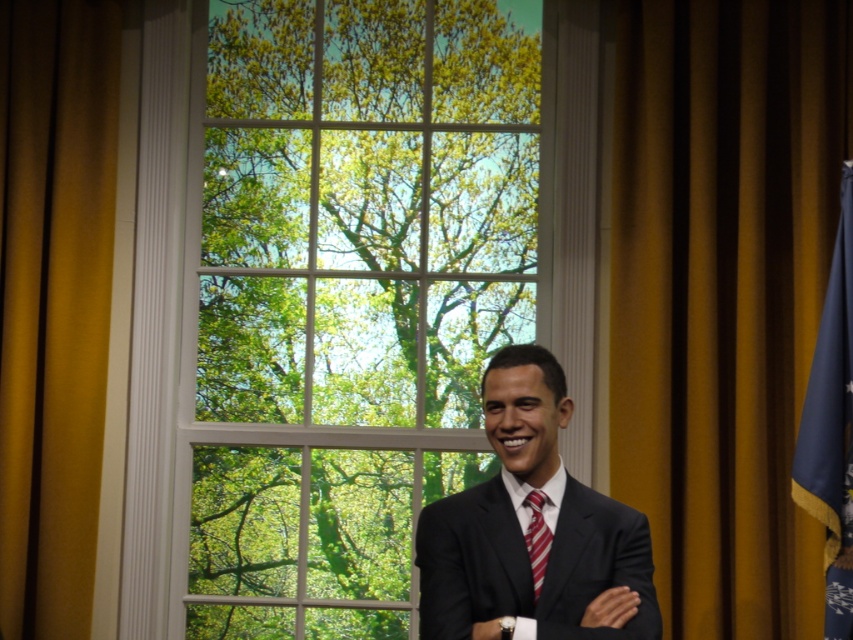
Consider the image. You are standing in the room where the figure is. The point at coordinates (335, 289) is marked. What object is located at that point?

The point at coordinates (335, 289) marks the white glass window at center.

You are an interior designer planning to hang a decorative item between the gold fabric curtain at right and the blue fabric flag at right. The item requires 12 inches of space. Do you think there is enough space between them?

The gold fabric curtain at right is 12.64 inches from blue fabric flag at right, so yes, there is enough space to hang the decorative item between them since 12.64 inches is more than the required 12 inches.